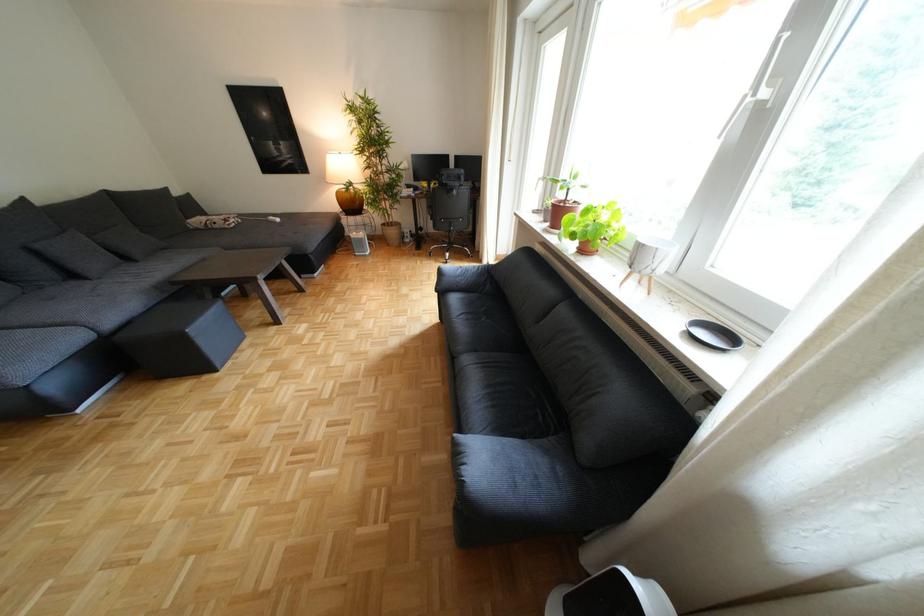
The width and height of the screenshot is (924, 616). In order to click on black chair armrest in this screenshot , I will do `click(451, 249)`.